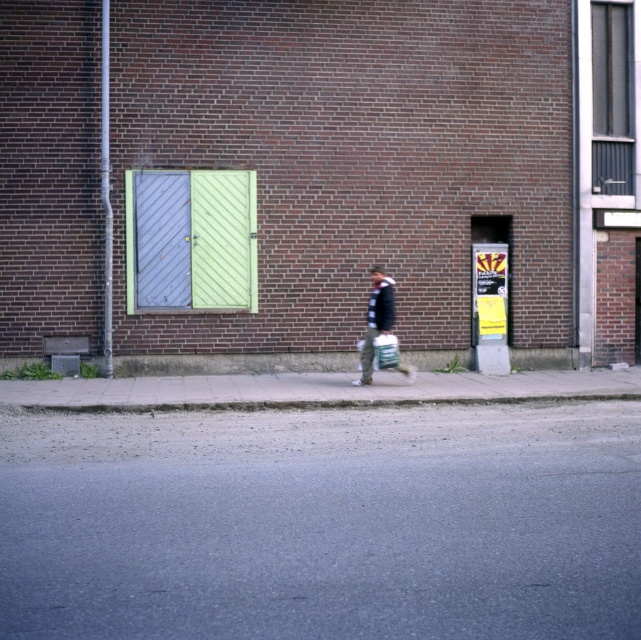
Question: Which object is the farthest from the green fabric shopping bag at center?

Choices:
 (A) light green textured door at center
 (B) dark blue jacket at center
 (C) metallic gray shutter at upper right
 (D) gray asphalt at lower center

Answer: (C)

Question: Does gray asphalt at lower center lie in front of dark blue jacket at center?

Choices:
 (A) no
 (B) yes

Answer: (B)

Question: Considering the relative positions of gray asphalt at lower center and green fabric shopping bag at center in the image provided, where is gray asphalt at lower center located with respect to green fabric shopping bag at center?

Choices:
 (A) above
 (B) below

Answer: (B)

Question: Which object is the closest to the light green textured door at center?

Choices:
 (A) dark blue jacket at center
 (B) metallic gray shutter at upper right
 (C) gray asphalt at lower center
 (D) green fabric shopping bag at center

Answer: (A)

Question: Is dark blue jacket at center smaller than green fabric shopping bag at center?

Choices:
 (A) yes
 (B) no

Answer: (B)

Question: Which of the following is the farthest from the observer?

Choices:
 (A) (629, 88)
 (B) (381, 301)
 (C) (388, 362)
 (D) (353, 483)

Answer: (A)